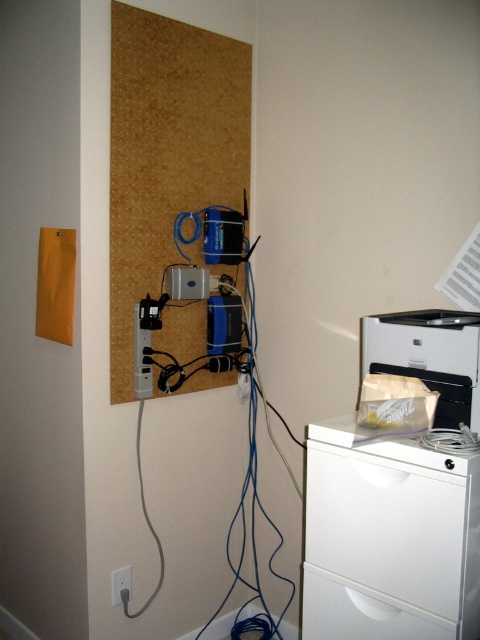
You are organizing the desk area and need to place a new box that measures 18 inches in length. You have space near the white matte printer at lower right and the white plastic drawer at lower right. Which object should you place the box next to to ensure it fits?

The white matte printer at lower right has a larger size compared to the white plastic drawer at lower right, so the box will fit better next to the white matte printer at lower right.

You are organizing the room and need to place a large box that requires 1.5 square feet of space. Which object between the white plastic file cabinet at lower right and the white plastic drawer at lower right can you place the box next to without moving either object?

The white plastic file cabinet at lower right is larger in size than the white plastic drawer at lower right, so placing the box next to the white plastic drawer at lower right would require less space and might be feasible. However, since the file cabinet is larger, it might have more adjacent space available. Without specific spatial layout details, it is safer to assume the larger object has more space around it. Therefore, the box should be placed next to the white plastic file cabinet at lower right.

You are standing in front of the corkboard and want to reach two points marked on the wall. One is at point [355,627] and the other is at point [130,573]. Which point will you touch first if you extend your hand straight out?

The point at [355,627] is closer to the viewer than the point at [130,573], so you will touch the point at [355,627] first.